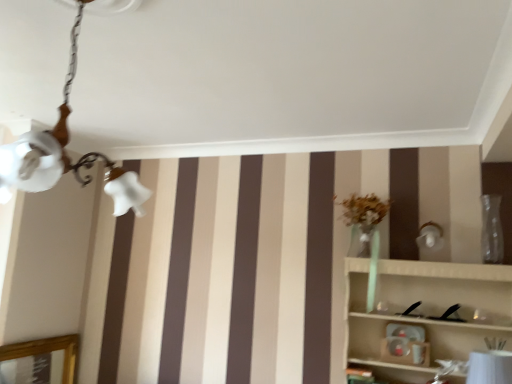
Question: Is point click(x=505, y=375) positioned closer to the camera than point click(x=425, y=329)?

Choices:
 (A) farther
 (B) closer

Answer: (B)

Question: Considering the relative positions of white glossy table lamp at lower right and wooden shelf at right in the image provided, is white glossy table lamp at lower right to the left or to the right of wooden shelf at right?

Choices:
 (A) right
 (B) left

Answer: (A)

Question: Considering the real-world distances, which object is farthest from the wooden shelf at right?

Choices:
 (A) white frosted glass chandelier at upper left
 (B) transparent glass vase at right
 (C) white glossy table lamp at lower right

Answer: (A)

Question: Estimate the real-world distances between objects in this image. Which object is closer to the transparent glass vase at right?

Choices:
 (A) white glossy table lamp at lower right
 (B) wooden shelf at right
 (C) white frosted glass chandelier at upper left

Answer: (B)